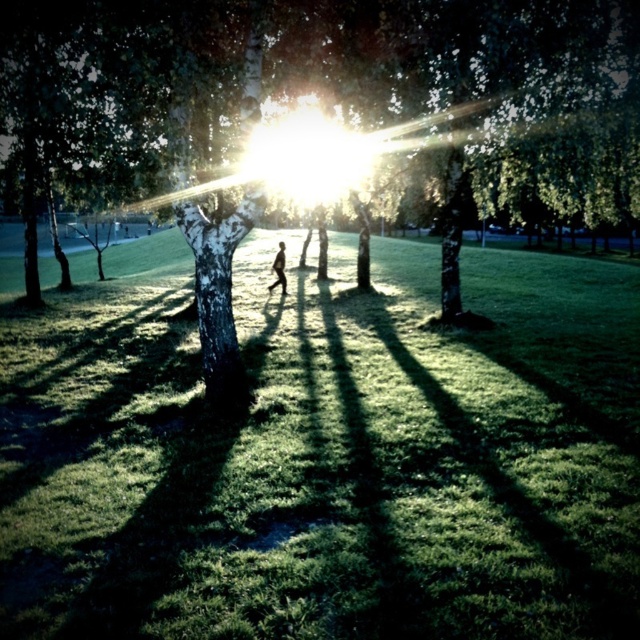
Question: Is green matte tree at center below dark skin person at center?

Choices:
 (A) yes
 (B) no

Answer: (B)

Question: Where is green grassy at center located in relation to green matte tree at center in the image?

Choices:
 (A) below
 (B) above

Answer: (A)

Question: Among these points, which one is farthest from the camera?

Choices:
 (A) (627, 621)
 (B) (195, 212)
 (C) (282, 244)

Answer: (C)

Question: Considering the real-world distances, which object is farthest from the green matte tree at center?

Choices:
 (A) green grassy at center
 (B) dark skin person at center

Answer: (B)

Question: Which of the following is the closest to the observer?

Choices:
 (A) dark skin person at center
 (B) green grassy at center

Answer: (B)

Question: Can you confirm if green grassy at center is positioned above dark skin person at center?

Choices:
 (A) no
 (B) yes

Answer: (A)